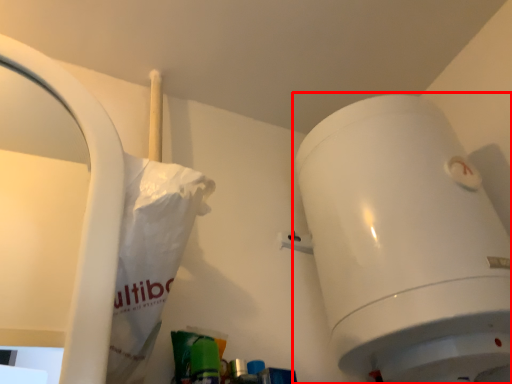
Question: In this image, where is toilet (annotated by the red box) located relative to paper bag?

Choices:
 (A) left
 (B) right

Answer: (B)